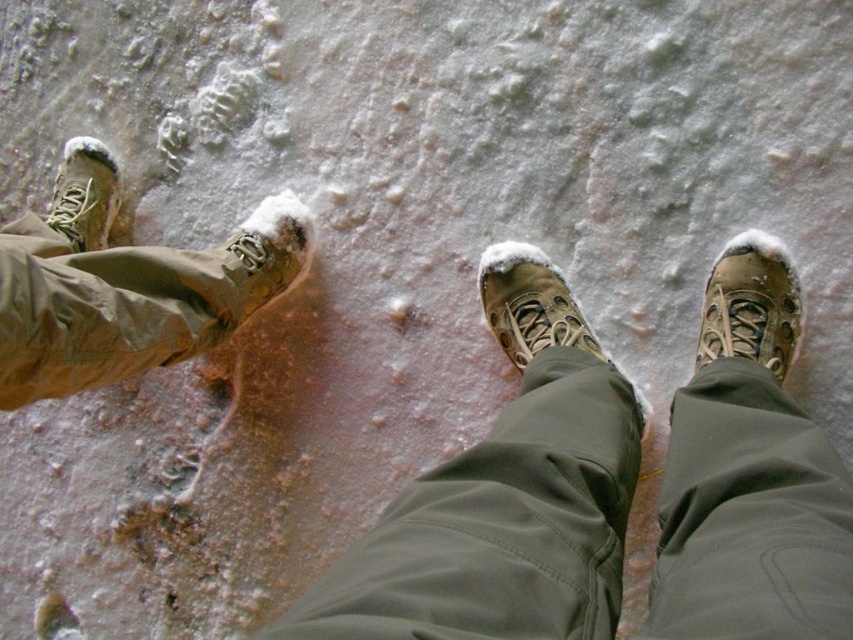
Question: Estimate the real-world distances between objects in this image. Which object is closer to the matte brown hiking boots at center?

Choices:
 (A) matte brown hiking boot at left
 (B) leather lace-up boot at center

Answer: (B)

Question: Estimate the real-world distances between objects in this image. Which object is closer to the brown suede boot at center?

Choices:
 (A) matte brown boot at center
 (B) matte brown hiking boot at left
 (C) matte brown boot at left

Answer: (A)

Question: Which of the following is the farthest from the observer?

Choices:
 (A) (164, 330)
 (B) (776, 296)
 (C) (750, 266)

Answer: (C)

Question: Does matte brown hiking boot at left lie behind matte brown boot at center?

Choices:
 (A) yes
 (B) no

Answer: (B)

Question: Can you confirm if leather lace-up boot at center is wider than brown suede boot at center?

Choices:
 (A) no
 (B) yes

Answer: (A)

Question: Does matte brown hiking boots at center appear on the left side of matte brown boot at left?

Choices:
 (A) yes
 (B) no

Answer: (B)